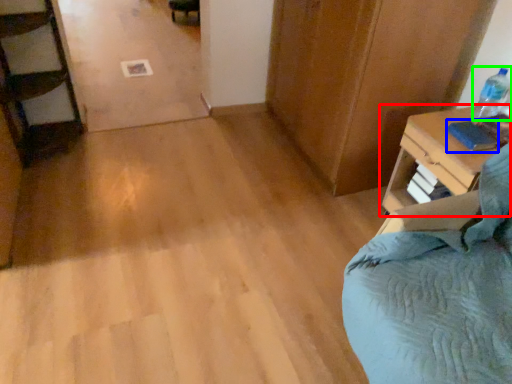
Question: Which object is the farthest from nightstand (highlighted by a red box)? Choose among these: book (highlighted by a blue box) or bottle (highlighted by a green box).

Choices:
 (A) book
 (B) bottle

Answer: (B)